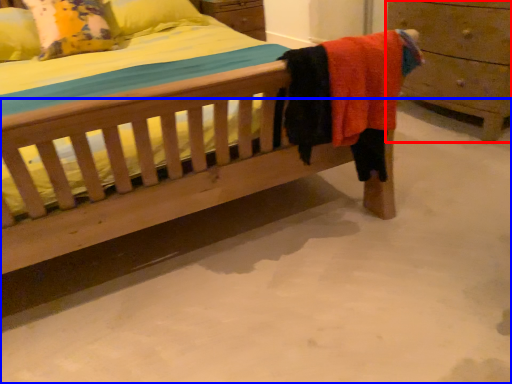
Question: Which point is further to the camera, chest of drawers (highlighted by a red box) or concrete (highlighted by a blue box)?

Choices:
 (A) chest of drawers
 (B) concrete

Answer: (A)